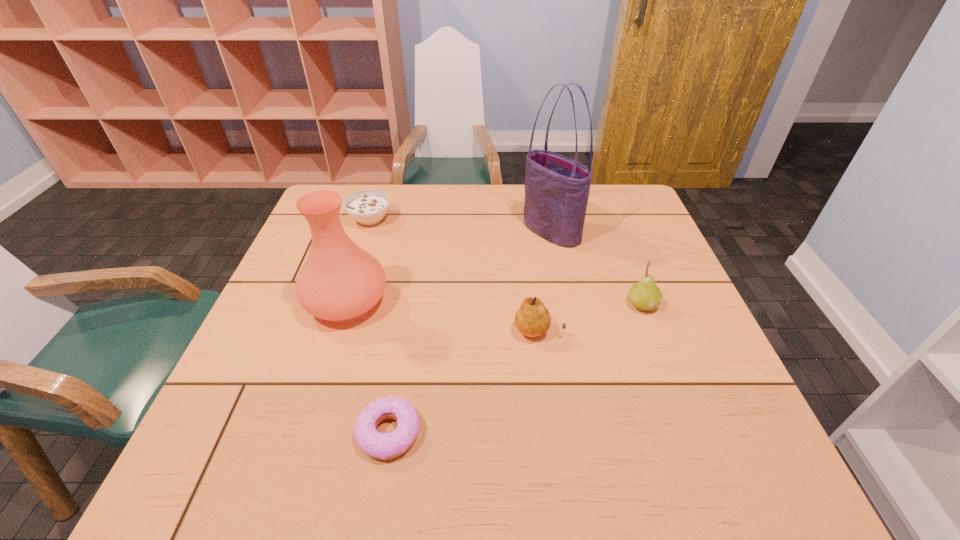
Image resolution: width=960 pixels, height=540 pixels. Identify the location of vacant area that lies between the fifth tallest object and the shortest object. (381, 326).

Find the location of `free space between the fifth tallest object and the right pear`. free space between the fifth tallest object and the right pear is located at coordinates (506, 262).

The width and height of the screenshot is (960, 540). I want to click on free space that is in between the tote bag and the nearest object, so 471,332.

You are a GUI agent. You are given a task and a screenshot of the screen. Output one action in this format:
    pyautogui.click(x=<x>, y=<y>)
    Task: Click on the free spot between the vase and the farther pear
    
    Given the screenshot: What is the action you would take?
    pyautogui.click(x=494, y=303)

I want to click on empty space that is in between the shortest object and the tote bag, so click(471, 332).

Locate an element on the screen. This screenshot has width=960, height=540. object that can be found as the closest to the tote bag is located at coordinates (644, 295).

Locate an element on the screen. object that is the fifth closest to the right pear is located at coordinates (368, 207).

I want to click on blank space that satisfies the following two spatial constraints: 1. on the back side of the tote bag; 2. on the left side of the third shortest object, so click(x=525, y=231).

Identify the location of free space that satisfies the following two spatial constraints: 1. on the front side of the fifth shortest object; 2. on the right side of the soup bowl. (344, 302).